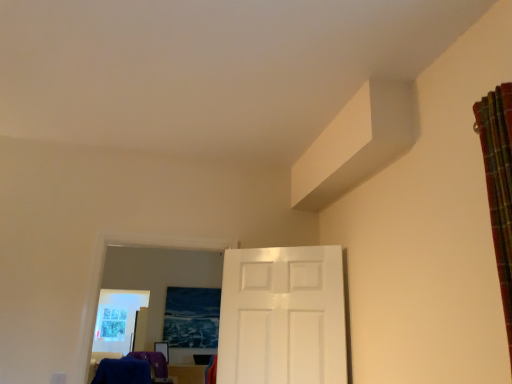
Question: Is plaid fabric curtain at right at the right side of blue fuzzy laundry at lower left?

Choices:
 (A) yes
 (B) no

Answer: (A)

Question: Can we say plaid fabric curtain at right lies outside blue fuzzy laundry at lower left?

Choices:
 (A) yes
 (B) no

Answer: (A)

Question: Could you tell me if plaid fabric curtain at right is facing blue fuzzy laundry at lower left?

Choices:
 (A) no
 (B) yes

Answer: (A)

Question: From a real-world perspective, is plaid fabric curtain at right physically above blue fuzzy laundry at lower left?

Choices:
 (A) no
 (B) yes

Answer: (B)

Question: From the image's perspective, is plaid fabric curtain at right on top of blue fuzzy laundry at lower left?

Choices:
 (A) yes
 (B) no

Answer: (A)

Question: From the image's perspective, is plaid fabric curtain at right above or below blue fuzzy laundry at lower left?

Choices:
 (A) above
 (B) below

Answer: (A)

Question: Does point (497, 155) appear closer or farther from the camera than point (160, 359)?

Choices:
 (A) farther
 (B) closer

Answer: (B)

Question: From a real-world perspective, is plaid fabric curtain at right positioned above or below blue fuzzy laundry at lower left?

Choices:
 (A) below
 (B) above

Answer: (B)

Question: Choose the correct answer: Is plaid fabric curtain at right inside blue fuzzy laundry at lower left or outside it?

Choices:
 (A) inside
 (B) outside

Answer: (B)

Question: Would you say blue fuzzy laundry at lower left is inside or outside plaid fabric curtain at right?

Choices:
 (A) outside
 (B) inside

Answer: (A)

Question: Is blue fuzzy laundry at lower left taller or shorter than plaid fabric curtain at right?

Choices:
 (A) short
 (B) tall

Answer: (A)

Question: From a real-world perspective, is blue fuzzy laundry at lower left positioned above or below plaid fabric curtain at right?

Choices:
 (A) below
 (B) above

Answer: (A)

Question: From the image's perspective, is blue fuzzy laundry at lower left above or below plaid fabric curtain at right?

Choices:
 (A) below
 (B) above

Answer: (A)

Question: From their relative heights in the image, would you say blue fuzzy laundry at lower left is taller or shorter than white glossy door at center?

Choices:
 (A) short
 (B) tall

Answer: (A)

Question: Considering the positions of blue fuzzy laundry at lower left and white glossy door at center in the image, is blue fuzzy laundry at lower left wider or thinner than white glossy door at center?

Choices:
 (A) wide
 (B) thin

Answer: (A)